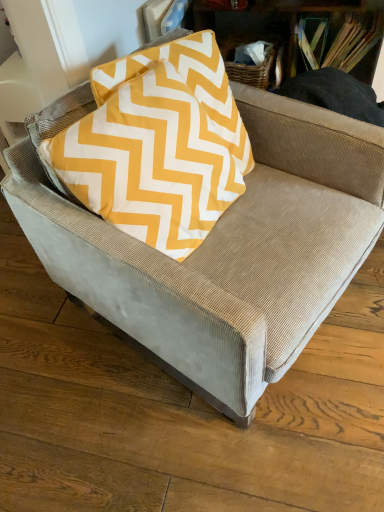
Question: From a real-world perspective, does yellow fabric pillow at upper center stand above wooden book at upper right?

Choices:
 (A) yes
 (B) no

Answer: (A)

Question: Could you tell me if yellow fabric pillow at upper center is facing wooden book at upper right?

Choices:
 (A) yes
 (B) no

Answer: (B)

Question: Does yellow fabric pillow at upper center appear on the left side of wooden book at upper right?

Choices:
 (A) yes
 (B) no

Answer: (A)

Question: Is yellow fabric pillow at upper center wider than wooden book at upper right?

Choices:
 (A) no
 (B) yes

Answer: (A)

Question: Can you see yellow fabric pillow at upper center touching wooden book at upper right?

Choices:
 (A) yes
 (B) no

Answer: (B)

Question: Is yellow fabric pillow at upper center at the right side of wooden book at upper right?

Choices:
 (A) no
 (B) yes

Answer: (A)

Question: Is wooden book at upper right further to camera compared to yellow fabric pillow at upper center?

Choices:
 (A) yes
 (B) no

Answer: (A)

Question: From the image's perspective, is wooden book at upper right below yellow fabric pillow at upper center?

Choices:
 (A) yes
 (B) no

Answer: (B)

Question: Are wooden book at upper right and yellow fabric pillow at upper center far apart?

Choices:
 (A) yes
 (B) no

Answer: (B)

Question: Can you confirm if wooden book at upper right is wider than yellow fabric pillow at upper center?

Choices:
 (A) yes
 (B) no

Answer: (A)

Question: Considering the relative sizes of wooden book at upper right and yellow fabric pillow at upper center in the image provided, is wooden book at upper right thinner than yellow fabric pillow at upper center?

Choices:
 (A) yes
 (B) no

Answer: (B)

Question: Is wooden book at upper right taller than yellow fabric pillow at upper center?

Choices:
 (A) yes
 (B) no

Answer: (B)

Question: From the image's perspective, relative to wooden book at upper right, is yellow fabric pillow at upper center above or below?

Choices:
 (A) below
 (B) above

Answer: (A)